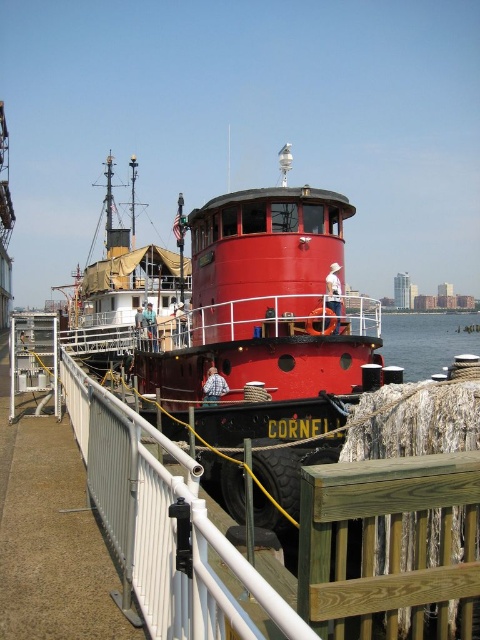
You are standing on the pier next to the shiny red boat at center. You want to throw a ball to your friend who is standing 15 meters away from you. Can you reach your friend by throwing the ball from your current position?

The shiny red boat at center is 13.22 meters away from you. Since your friend is 15 meters away, which is farther than the boat, you might not be able to reach them unless you can throw the ball beyond the boat.

You are a dock worker who needs to move a 10 meter long cargo container from the shiny red boat at center to the brushed metal boat at center. Can you safely transport it without the container overlapping between them?

The distance between the shiny red boat at center and the brushed metal boat at center is 11.43 meters. Since the cargo container is only 10 meters long, there is enough space to transport it safely without overlapping.

You are standing on the pier and looking at the tugboat Cornell. You notice two boats at the center of the image. Which boat is closer to you, the shiny red boat at center or the brushed metal boat at center?

The shiny red boat at center is closer to you because it is positioned under the brushed metal boat at center, meaning it is in a lower, more forward position relative to your viewpoint.